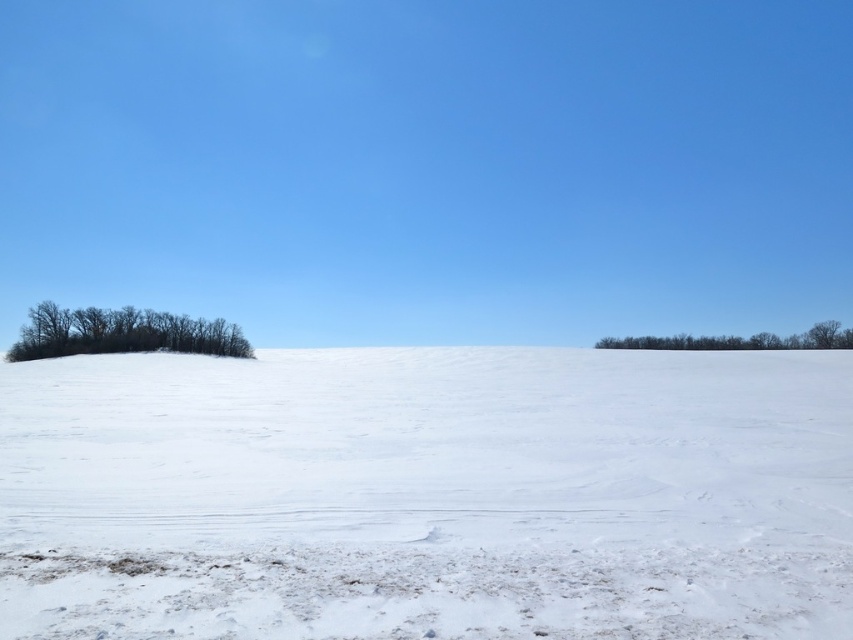
Based on the photo, you are an observer standing at the bottom edge of the snow. You see the white powdery snow at center and the green leafy trees at right. Which object is taller?

The green leafy trees at right are taller than the white powdery snow at center.